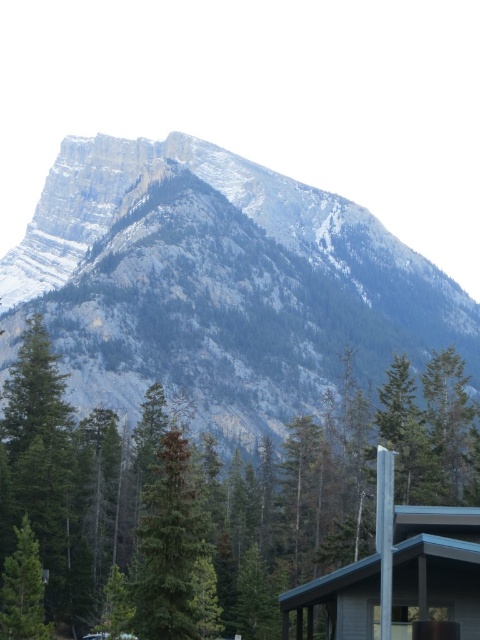
Question: Based on their relative distances, which object is farther from the green matte evergreen tree at center?

Choices:
 (A) rocky gray mountain at upper center
 (B) green matte tree at center
 (C) wooden cabin at lower right

Answer: (A)

Question: Which point is closer to the camera?

Choices:
 (A) green matte evergreen tree at center
 (B) wooden cabin at lower right

Answer: (B)

Question: In this image, where is rocky gray mountain at upper center located relative to green matte evergreen tree at center?

Choices:
 (A) below
 (B) above

Answer: (B)

Question: Does rocky gray mountain at upper center come behind green matte tree at center?

Choices:
 (A) no
 (B) yes

Answer: (B)

Question: Does rocky gray mountain at upper center have a greater width compared to wooden cabin at lower right?

Choices:
 (A) no
 (B) yes

Answer: (B)

Question: Estimate the real-world distances between objects in this image. Which object is closer to the green matte tree at center?

Choices:
 (A) green matte evergreen tree at center
 (B) wooden cabin at lower right
 (C) rocky gray mountain at upper center

Answer: (A)